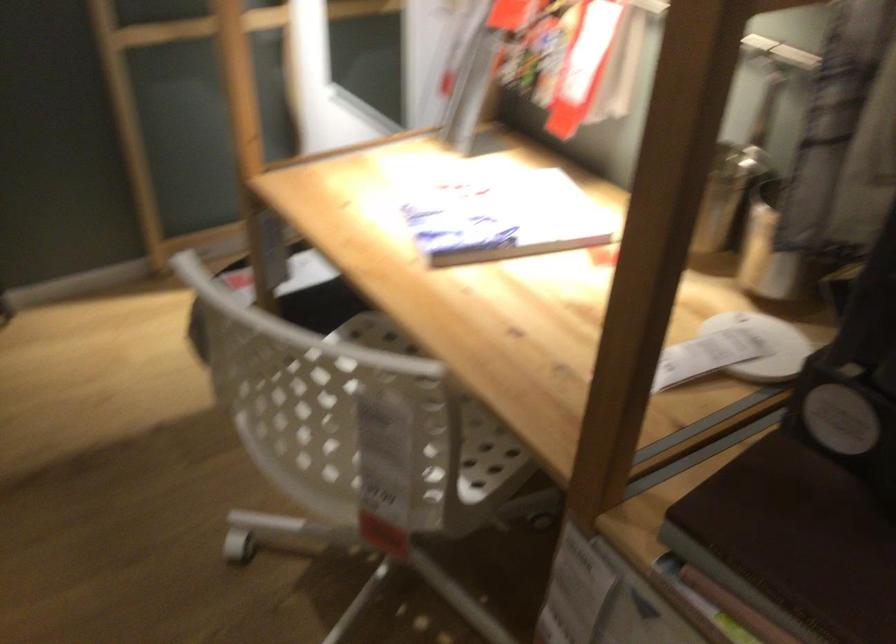
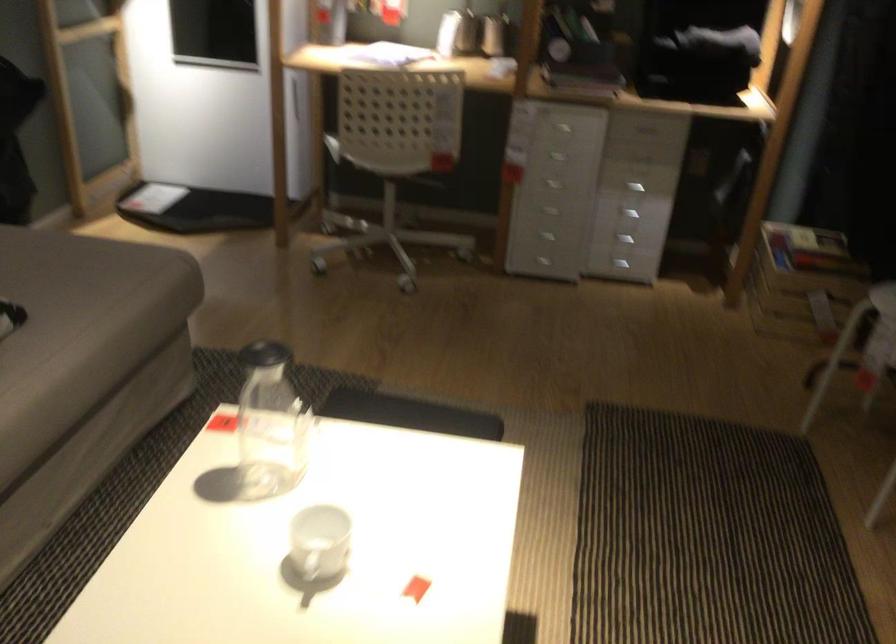
Find the pixel in the second image that matches pixel 309 451 in the first image.

(388, 158)